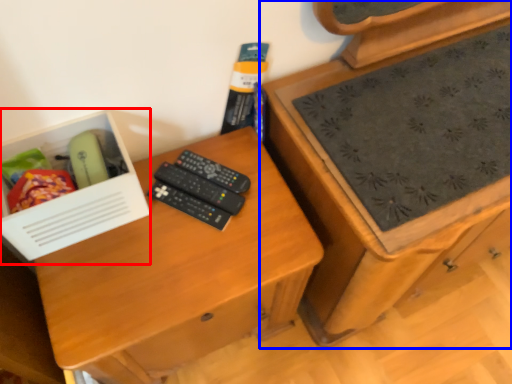
Question: Which point is closer to the camera, box (highlighted by a red box) or chest of drawers (highlighted by a blue box)?

Choices:
 (A) box
 (B) chest of drawers

Answer: (A)